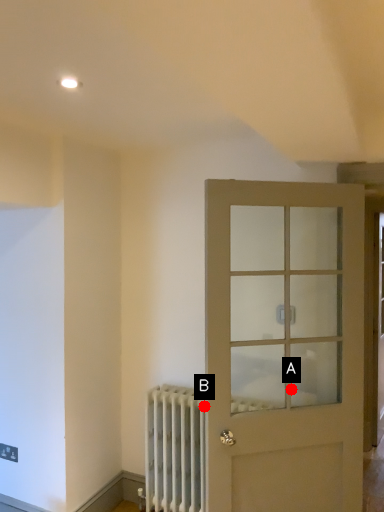
Question: Two points are circled on the image, labeled by A and B beside each circle. Which point is further to the camera?

Choices:
 (A) A is further
 (B) B is further

Answer: (B)